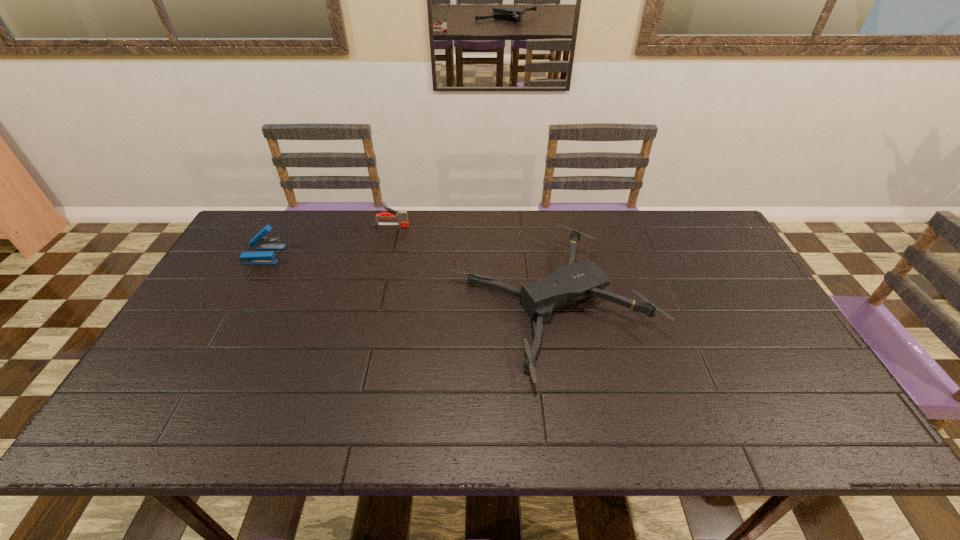
This screenshot has height=540, width=960. Identify the location of object positioned at the far left corner. (258, 242).

In the image, there is a desktop. Identify the location of vacant region at the far edge. (627, 213).

In the image, there is a desktop. Identify the location of vacant space at the near edge. (675, 423).

Where is `free space at the left edge of the desktop`? Image resolution: width=960 pixels, height=540 pixels. free space at the left edge of the desktop is located at coordinates (x=278, y=258).

The width and height of the screenshot is (960, 540). Find the location of `vacant space at the right edge`. vacant space at the right edge is located at coordinates (705, 263).

In order to click on free space at the far left corner in this screenshot , I will do `click(281, 218)`.

Identify the location of unoccupied position between the left stapler and the second object from left to right. (328, 240).

Image resolution: width=960 pixels, height=540 pixels. I want to click on vacant area that lies between the rightmost object and the right stapler, so click(x=471, y=266).

In order to click on empty space between the drone and the left stapler in this screenshot , I will do `click(407, 280)`.

Image resolution: width=960 pixels, height=540 pixels. Identify the location of empty location between the farther stapler and the left stapler. (328, 240).